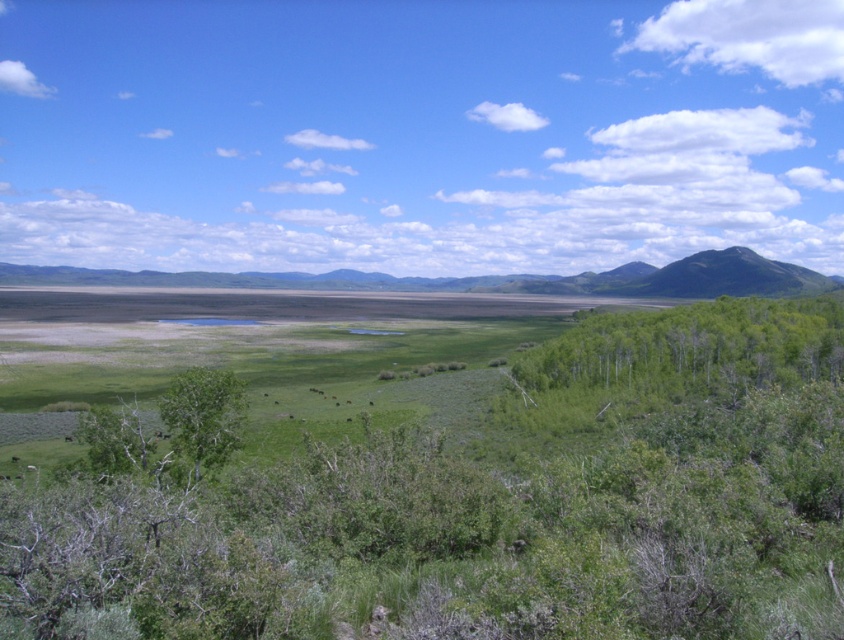
Between green leafy trees at right and green leafy tree at center, which one has less height?

With less height is green leafy tree at center.

Who is positioned more to the left, green leafy trees at right or green leafy tree at center?

Positioned to the left is green leafy tree at center.

Between point (577, 372) and point (192, 436), which one is positioned in front?

Positioned in front is point (192, 436).

Find the location of a particular element. Image resolution: width=844 pixels, height=640 pixels. green leafy trees at right is located at coordinates (693, 348).